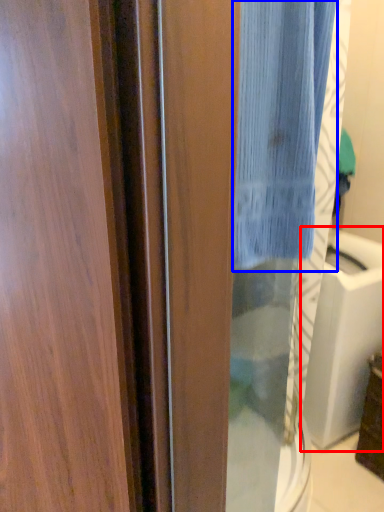
Question: Which object is further to the camera taking this photo, sink (highlighted by a red box) or curtain (highlighted by a blue box)?

Choices:
 (A) sink
 (B) curtain

Answer: (A)